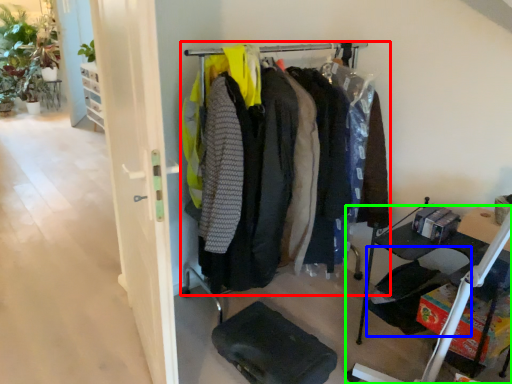
Question: Which object is the farthest from closet (highlighted by a red box)? Choose among these: folding chair (highlighted by a blue box) or furniture (highlighted by a green box).

Choices:
 (A) folding chair
 (B) furniture

Answer: (B)